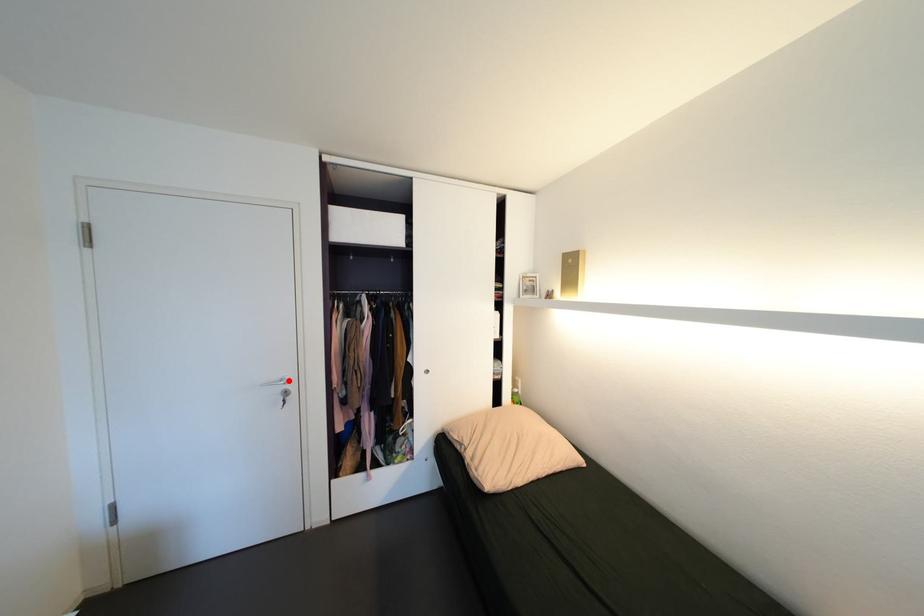
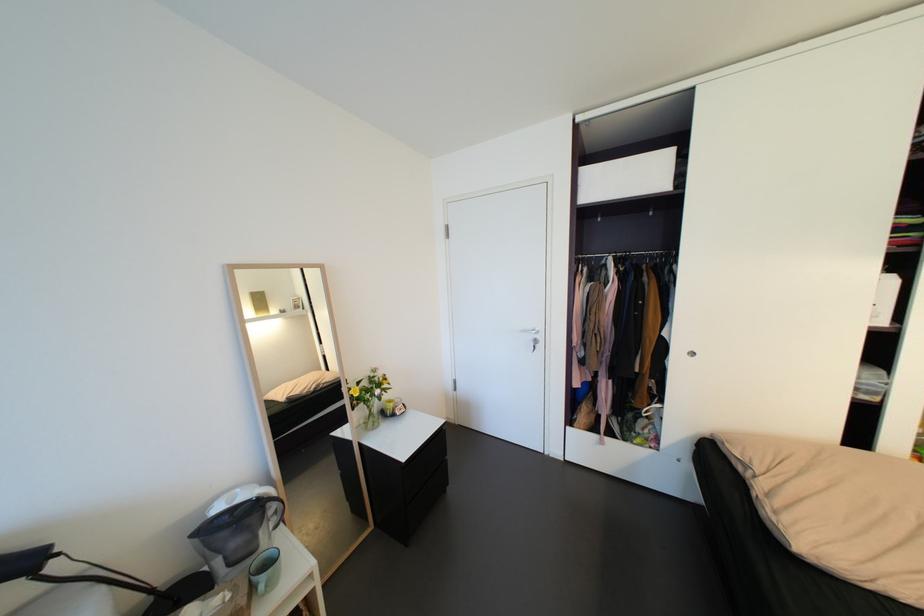
Locate, in the second image, the point that corresponds to the highlighted location in the first image.

(541, 331)